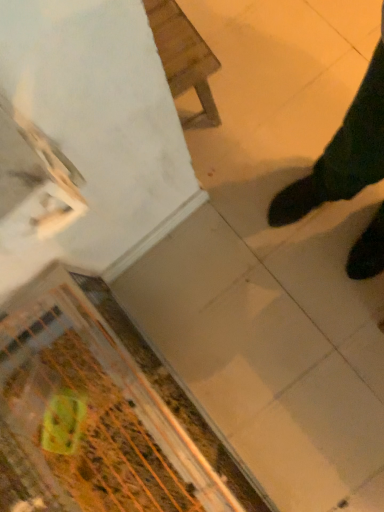
Where is `wooden chair at upper center`? wooden chair at upper center is located at coordinates point(184,59).

Image resolution: width=384 pixels, height=512 pixels. What do you see at coordinates (184, 59) in the screenshot? I see `wooden chair at upper center` at bounding box center [184, 59].

What is the approximate height of green plastic bag at lower left?

It is 6.17 inches.

Where is `green plastic bag at lower left`? The height and width of the screenshot is (512, 384). green plastic bag at lower left is located at coordinates (94, 434).

What is the approximate width of green plastic bag at lower left?

6.90 inches.

What do you see at coordinates (94, 434) in the screenshot? I see `green plastic bag at lower left` at bounding box center [94, 434].

In order to click on wooden chair at upper center in this screenshot , I will do `click(184, 59)`.

Between wooden chair at upper center and green plastic bag at lower left, which one appears on the right side from the viewer's perspective?

wooden chair at upper center is more to the right.

Considering the relative positions of wooden chair at upper center and green plastic bag at lower left in the image provided, is wooden chair at upper center in front of green plastic bag at lower left?

No, wooden chair at upper center is behind green plastic bag at lower left.

Between point (184, 14) and point (138, 432), which one is positioned behind?

The point (138, 432) is behind.

From the image's perspective, is wooden chair at upper center on green plastic bag at lower left?

Yes.

From a real-world perspective, which object rests below the other?

From a 3D spatial view, wooden chair at upper center is below.

Does wooden chair at upper center have a lesser width compared to green plastic bag at lower left?

Yes, wooden chair at upper center is thinner than green plastic bag at lower left.

Can you confirm if wooden chair at upper center is taller than green plastic bag at lower left?

Yes, wooden chair at upper center is taller than green plastic bag at lower left.

Can you confirm if wooden chair at upper center is bigger than green plastic bag at lower left?

Yes.

Based on the photo, is wooden chair at upper center not within green plastic bag at lower left?

That's correct, wooden chair at upper center is outside of green plastic bag at lower left.

Is wooden chair at upper center positioned far away from green plastic bag at lower left?

No, wooden chair at upper center is not far away from green plastic bag at lower left.

Consider the image. Is wooden chair at upper center oriented towards green plastic bag at lower left?

No, wooden chair at upper center is not oriented towards green plastic bag at lower left.

How many degrees apart are the facing directions of wooden chair at upper center and green plastic bag at lower left?

wooden chair at upper center and green plastic bag at lower left are facing 10.8 degrees away from each other.

Consider the image. How much distance is there between wooden chair at upper center and green plastic bag at lower left?

30.40 inches.

You are a GUI agent. You are given a task and a screenshot of the screen. Output one action in this format:
    pyautogui.click(x=<x>, y=<y>)
    Task: Click on the debris below the wooden chair at upper center (from the image's perspective)
    The height and width of the screenshot is (512, 384).
    Given the screenshot: What is the action you would take?
    pyautogui.click(x=94, y=434)

Visually, is green plastic bag at lower left positioned to the left or to the right of wooden chair at upper center?

green plastic bag at lower left is to the left of wooden chair at upper center.

Is green plastic bag at lower left positioned behind wooden chair at upper center?

No, the depth of green plastic bag at lower left is less than that of wooden chair at upper center.

Between point (81, 462) and point (177, 18), which one is positioned behind?

The point (177, 18) is more distant.

From the image's perspective, between green plastic bag at lower left and wooden chair at upper center, which one is located above?

wooden chair at upper center appears higher in the image.

Consider the image. From a real-world perspective, who is located lower, green plastic bag at lower left or wooden chair at upper center?

wooden chair at upper center.

Looking at their sizes, would you say green plastic bag at lower left is wider or thinner than wooden chair at upper center?

green plastic bag at lower left is wider than wooden chair at upper center.

Considering the sizes of green plastic bag at lower left and wooden chair at upper center in the image, is green plastic bag at lower left taller or shorter than wooden chair at upper center?

green plastic bag at lower left is shorter than wooden chair at upper center.

Which of these two, green plastic bag at lower left or wooden chair at upper center, is smaller?

Smaller between the two is green plastic bag at lower left.

Is wooden chair at upper center a part of green plastic bag at lower left?

No, wooden chair at upper center is not a part of green plastic bag at lower left.

Are green plastic bag at lower left and wooden chair at upper center making contact?

No, green plastic bag at lower left is not making contact with wooden chair at upper center.

Is green plastic bag at lower left looking in the opposite direction of wooden chair at upper center?

No, green plastic bag at lower left is not facing away from wooden chair at upper center.

From the picture: Can you tell me how much green plastic bag at lower left and wooden chair at upper center differ in facing direction?

They differ by 10.8 degrees in their facing directions.

Locate an element on the screen. The width and height of the screenshot is (384, 512). debris in front of the wooden chair at upper center is located at coordinates (94, 434).

Where is `furniture below the green plastic bag at lower left (from a real-world perspective)`? This screenshot has width=384, height=512. furniture below the green plastic bag at lower left (from a real-world perspective) is located at coordinates tap(184, 59).

The height and width of the screenshot is (512, 384). I want to click on furniture on the right side of green plastic bag at lower left, so click(184, 59).